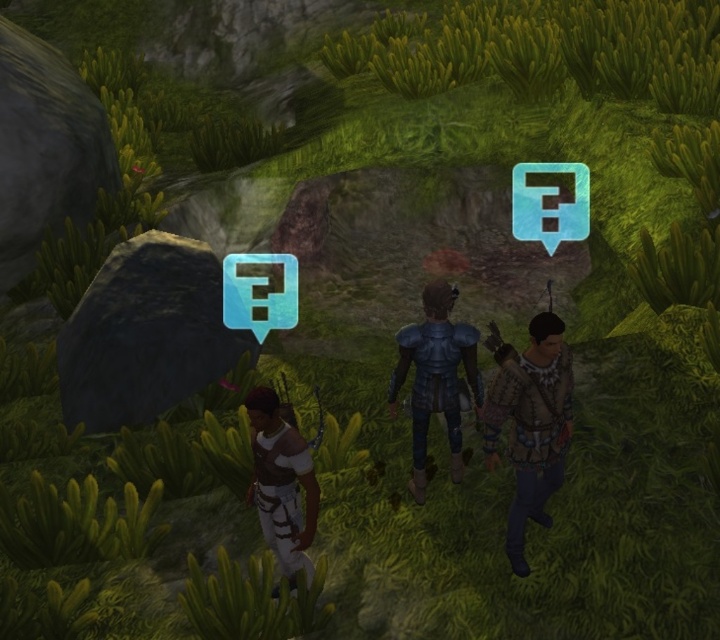
In the game scene, there are three characters positioned in a forest. The first character is on the left wearing a white sleeveless top and light pants with a quiver of arrows. The second character is in the center in blue armor. The third character is on the right wearing a brown leather vest. If you were to mark their positions on a coordinate grid where the bottom left corner is 0,0 and the top right is 1,1, which character is at point (531,422)?

The brown leather vest at right is represented by point (531,422).

In the game scene, you need to identify which object is bigger between the brown leather vest at right and the white leather pants at lower center. Can you tell me which one is larger?

The brown leather vest at right is larger than the white leather pants at lower center according to the description.